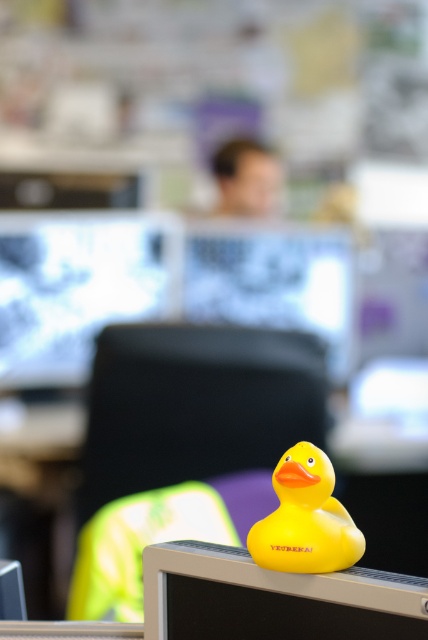
Question: Is matte black monitor at center below yellow rubber duck at center?

Choices:
 (A) yes
 (B) no

Answer: (B)

Question: Does matte black monitor at upper left have a larger size compared to matte black monitor at center?

Choices:
 (A) no
 (B) yes

Answer: (B)

Question: Which point is closer to the camera?

Choices:
 (A) (279, 536)
 (B) (237, 317)
 (C) (217, 570)
 (D) (155, 232)

Answer: (A)

Question: Which of the following is the farthest from the observer?

Choices:
 (A) (222, 550)
 (B) (195, 257)

Answer: (B)

Question: Is yellow rubber duck at lower center further to the viewer compared to yellow rubber duck at center?

Choices:
 (A) yes
 (B) no

Answer: (B)

Question: Which of the following is the farthest from the observer?

Choices:
 (A) (320, 595)
 (B) (314, 556)
 (C) (71, 298)
 (D) (344, 284)

Answer: (D)